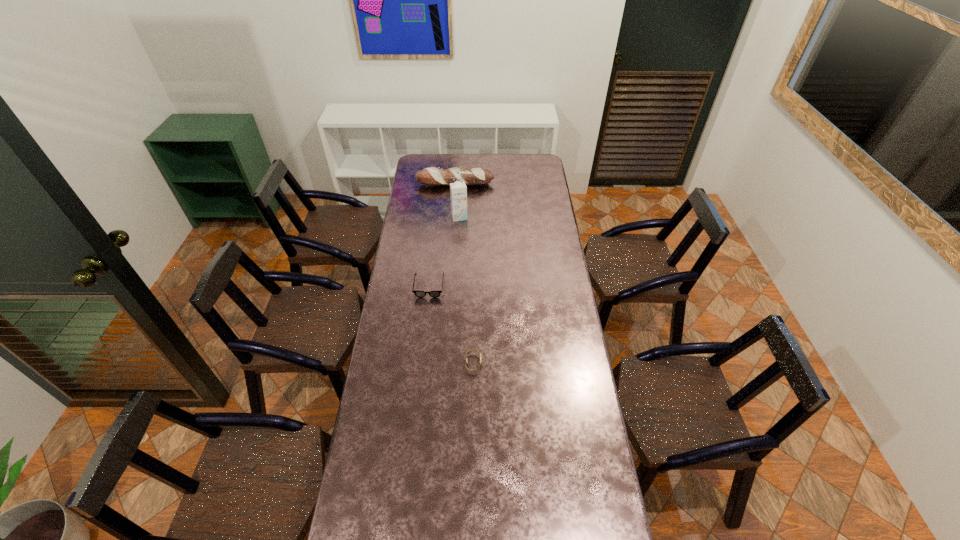
This screenshot has height=540, width=960. Identify the location of free spot located 0.250m on the face of the shortest object. (544, 363).

I want to click on baguet that is at the left edge, so click(x=436, y=176).

Where is `spectacles located at the left edge`? The width and height of the screenshot is (960, 540). spectacles located at the left edge is located at coordinates (420, 294).

At what (x,y) coordinates should I click in order to perform the action: click on vacant space at the far edge of the desktop. Please return your answer as a coordinate pair (x, y). The height and width of the screenshot is (540, 960). Looking at the image, I should click on (460, 157).

This screenshot has width=960, height=540. I want to click on vacant area at the left edge of the desktop, so click(378, 352).

This screenshot has height=540, width=960. In the image, there is a desktop. In order to click on vacant space at the right edge in this screenshot , I will do `click(544, 224)`.

This screenshot has width=960, height=540. What are the coordinates of `empty location between the watch and the third farthest object` in the screenshot? It's located at (451, 325).

The image size is (960, 540). I want to click on unoccupied area between the second tallest object and the shortest object, so click(x=465, y=273).

The height and width of the screenshot is (540, 960). In order to click on empty location between the second farthest object and the spectacles in this screenshot , I will do `click(444, 252)`.

The height and width of the screenshot is (540, 960). Identify the location of free space between the farthest object and the watch. (465, 273).